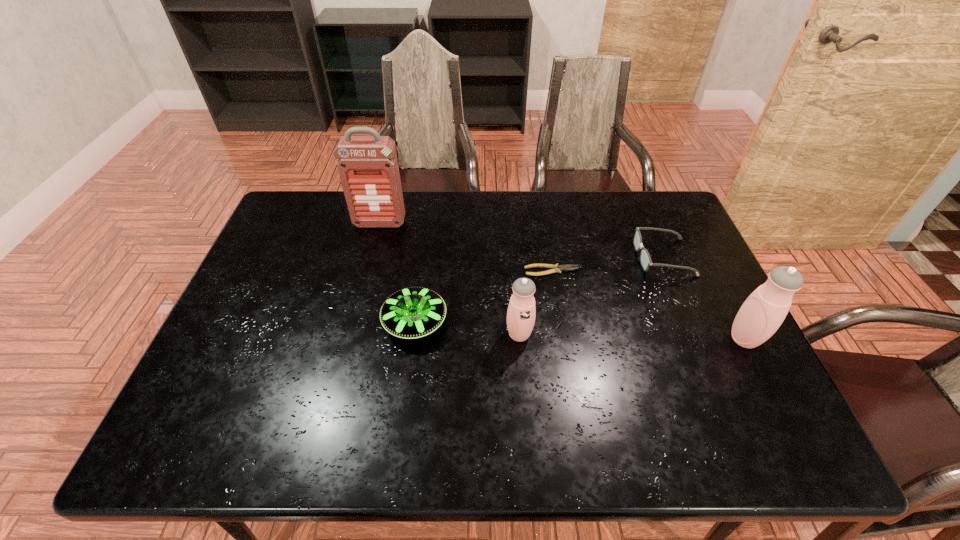
Locate an element on the screen. blank region between the shorter thermos bottle and the spectacles is located at coordinates (591, 296).

Locate an element on the screen. The image size is (960, 540). empty space between the tallest object and the shorter thermos bottle is located at coordinates (449, 279).

What are the coordinates of `vacant space that is in between the saucer and the spectacles` in the screenshot? It's located at (539, 289).

Identify the location of vacant area that lies between the pliers and the third shortest object. The width and height of the screenshot is (960, 540). (483, 296).

Locate an element on the screen. The width and height of the screenshot is (960, 540). free space between the farthest object and the left thermos bottle is located at coordinates (449, 279).

Where is `the fifth closest object to the first-aid kit`? the fifth closest object to the first-aid kit is located at coordinates (762, 313).

Identify which object is located as the fifth nearest to the pliers. Please provide its 2D coordinates. Your answer should be formatted as a tuple, i.e. [(x, y)], where the tuple contains the x and y coordinates of a point satisfying the conditions above.

[(368, 168)]

Where is `blank space that satisfies the following two spatial constraints: 1. on the front-facing side of the shortest object; 2. on the right side of the first-aid kit`? This screenshot has width=960, height=540. blank space that satisfies the following two spatial constraints: 1. on the front-facing side of the shortest object; 2. on the right side of the first-aid kit is located at coordinates (368, 271).

At what (x,y) coordinates should I click in order to perform the action: click on free space that satisfies the following two spatial constraints: 1. on the back side of the right thermos bottle; 2. on the face of the fifth tallest object. Please return your answer as a coordinate pair (x, y). The width and height of the screenshot is (960, 540). Looking at the image, I should click on (703, 257).

What are the coordinates of `vacant space that satisfies the following two spatial constraints: 1. on the front-facing side of the tallest object; 2. on the right side of the shortest object` in the screenshot? It's located at coord(368,271).